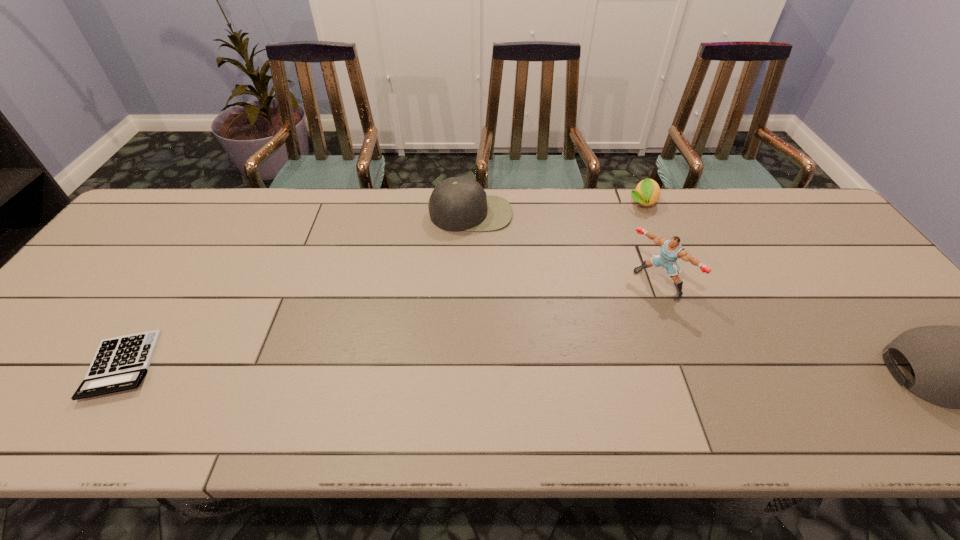
At what (x,y) coordinates should I click in order to perform the action: click on vacant space on the desktop that is between the calculator and the rightmost object and is positioned on the front-facing side of the tallest object. Please return your answer as a coordinate pair (x, y). Image resolution: width=960 pixels, height=540 pixels. Looking at the image, I should click on (548, 370).

Locate an element on the screen. vacant space on the desktop that is between the leftmost object and the rightmost object and is positioned with leaves positioned above the fourth tallest object is located at coordinates (638, 370).

Find the location of a particular element. The height and width of the screenshot is (540, 960). vacant space on the desktop that is between the leftmost object and the baseball cap and is positioned on the brim of the cap is located at coordinates (482, 369).